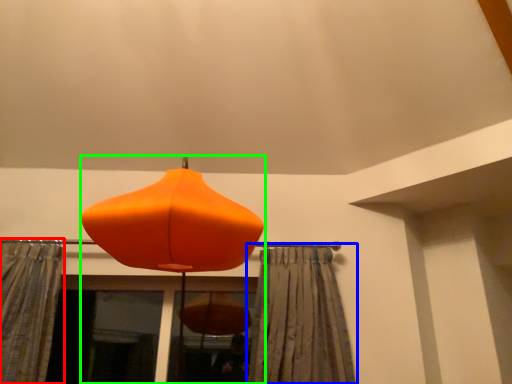
Question: Based on their relative distances, which object is nearer to curtain (highlighted by a red box)? Choose from curtain (highlighted by a blue box) and lamp (highlighted by a green box).

Choices:
 (A) curtain
 (B) lamp

Answer: (B)